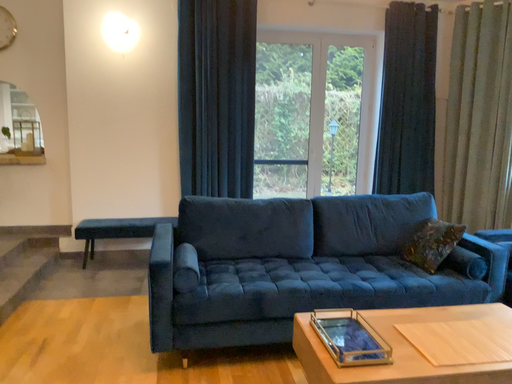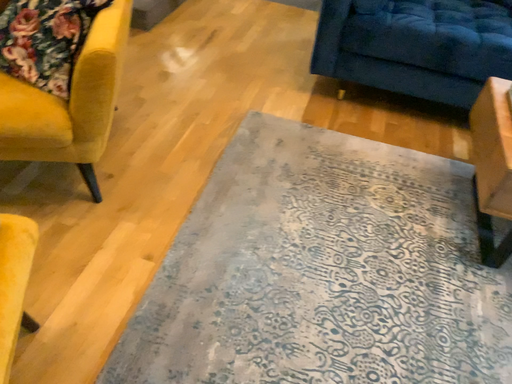
Question: Which way did the camera rotate in the video?

Choices:
 (A) rotated right
 (B) rotated left

Answer: (B)